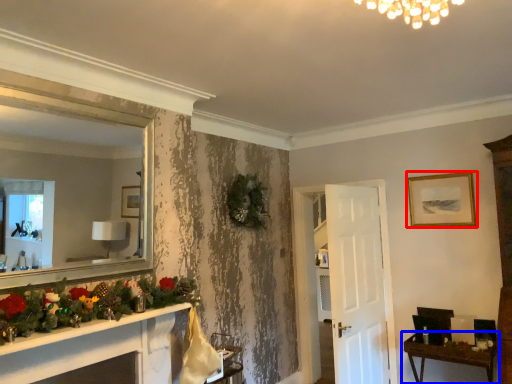
Question: Among these objects, which one is farthest to the camera, picture frame (highlighted by a red box) or table (highlighted by a blue box)?

Choices:
 (A) picture frame
 (B) table

Answer: (A)